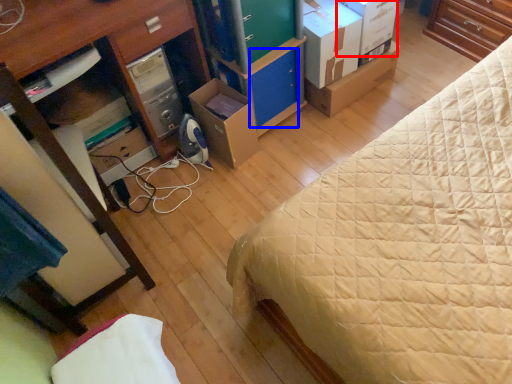
Question: Which of the following is the farthest to the observer, storage box (highlighted by a red box) or drawer (highlighted by a blue box)?

Choices:
 (A) storage box
 (B) drawer

Answer: (B)